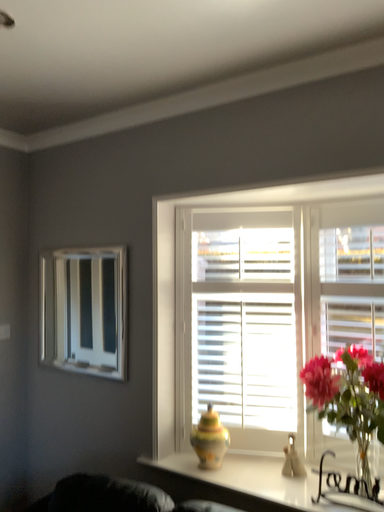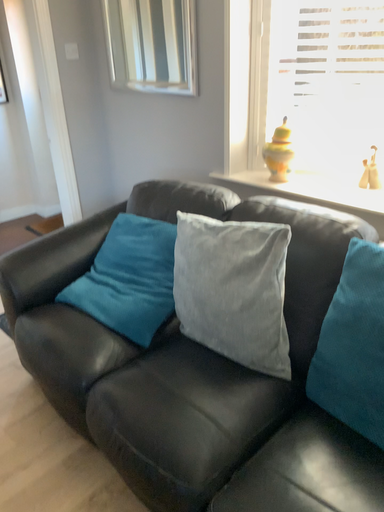
Question: Which way did the camera rotate in the video?

Choices:
 (A) rotated left
 (B) rotated right

Answer: (A)